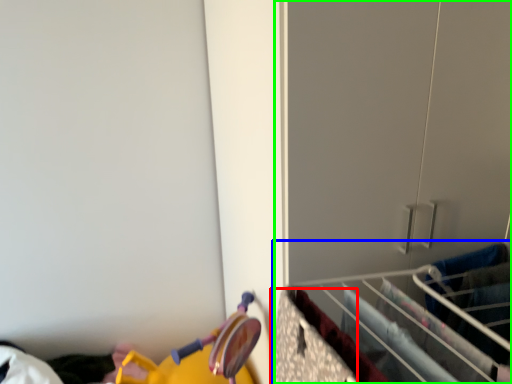
Question: Based on their relative distances, which object is nearer to drawer (highlighted by a red box)? Choose from closet (highlighted by a blue box) and closet (highlighted by a green box).

Choices:
 (A) closet
 (B) closet

Answer: (A)